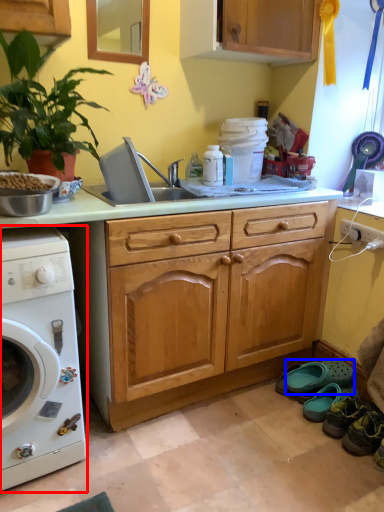
Question: Which point is closer to the camera, washing machine (highlighted by a red box) or shoe (highlighted by a blue box)?

Choices:
 (A) washing machine
 (B) shoe

Answer: (A)